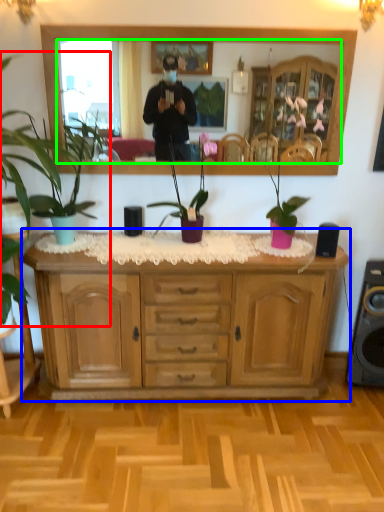
Question: Based on their relative distances, which object is farther from houseplant (highlighted by a red box)? Choose from cabinetry (highlighted by a blue box) and mirror (highlighted by a green box).

Choices:
 (A) cabinetry
 (B) mirror

Answer: (B)